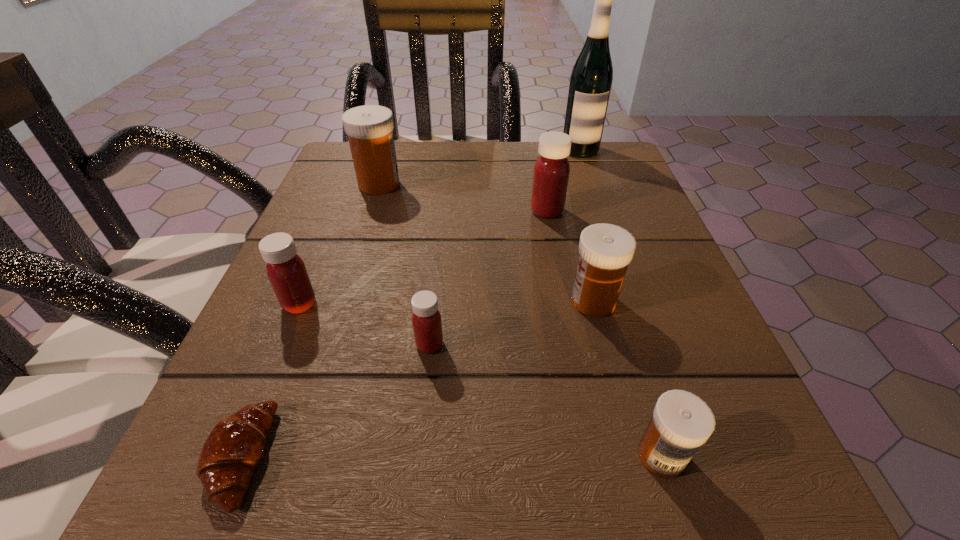
Where is `free spot located 0.130m on the right of the second red medicine from left to right`? The width and height of the screenshot is (960, 540). free spot located 0.130m on the right of the second red medicine from left to right is located at coordinates point(537,345).

Image resolution: width=960 pixels, height=540 pixels. Identify the location of vacant space situated 0.060m on the left of the smallest white medicine. (584, 456).

At what (x,y) coordinates should I click in order to perform the action: click on free location located 0.220m on the right of the shortest object. Please return your answer as a coordinate pair (x, y). Looking at the image, I should click on (463, 457).

This screenshot has height=540, width=960. Identify the location of wine bottle present at the far edge. (591, 78).

Where is `medicine that is positioned at the far edge`? The image size is (960, 540). medicine that is positioned at the far edge is located at coordinates (369, 128).

This screenshot has height=540, width=960. What are the coordinates of `medicine that is positioned at the near edge` in the screenshot? It's located at (681, 422).

At what (x,y) coordinates should I click in order to perform the action: click on crescent roll that is positioned at the near edge. Please return your answer as a coordinate pair (x, y). This screenshot has height=540, width=960. Looking at the image, I should click on (233, 449).

Image resolution: width=960 pixels, height=540 pixels. I want to click on crescent roll that is at the left edge, so click(x=233, y=449).

Image resolution: width=960 pixels, height=540 pixels. What are the coordinates of `wine bottle situated at the right edge` in the screenshot? It's located at (591, 78).

Image resolution: width=960 pixels, height=540 pixels. I want to click on object located at the far left corner, so click(369, 128).